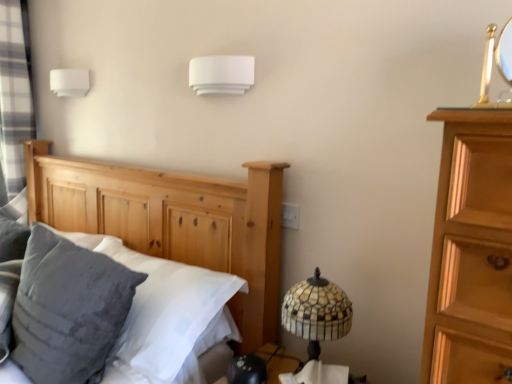
Question: Considering the relative sizes of gray plaid curtain at left and white matte rectangular object at upper left, arranged as the second lamp when viewed from the front, in the image provided, is gray plaid curtain at left thinner than white matte rectangular object at upper left, arranged as the second lamp when viewed from the front,?

Choices:
 (A) no
 (B) yes

Answer: (A)

Question: Considering the relative sizes of gray plaid curtain at left and white matte rectangular object at upper left, the 1th lamp when ordered from left to right, in the image provided, is gray plaid curtain at left taller than white matte rectangular object at upper left, the 1th lamp when ordered from left to right,?

Choices:
 (A) no
 (B) yes

Answer: (B)

Question: Are gray plaid curtain at left and white matte rectangular object at upper left, marked as the 2th lamp in a right-to-left arrangement, beside each other?

Choices:
 (A) no
 (B) yes

Answer: (A)

Question: Is gray plaid curtain at left facing towards white matte rectangular object at upper left, marked as the 2th lamp in a right-to-left arrangement?

Choices:
 (A) yes
 (B) no

Answer: (B)

Question: Considering the relative sizes of gray plaid curtain at left and white matte rectangular object at upper left, acting as the 1th lamp starting from the back, in the image provided, is gray plaid curtain at left bigger than white matte rectangular object at upper left, acting as the 1th lamp starting from the back,?

Choices:
 (A) no
 (B) yes

Answer: (B)

Question: In terms of width, does white plastic electric outlet at center look wider or thinner when compared to mosaic glass lampshade at lower right?

Choices:
 (A) thin
 (B) wide

Answer: (A)

Question: Based on their sizes in the image, would you say white plastic electric outlet at center is bigger or smaller than mosaic glass lampshade at lower right?

Choices:
 (A) big
 (B) small

Answer: (B)

Question: Is white plastic electric outlet at center to the left or to the right of mosaic glass lampshade at lower right in the image?

Choices:
 (A) left
 (B) right

Answer: (A)

Question: In terms of height, does white plastic electric outlet at center look taller or shorter compared to mosaic glass lampshade at lower right?

Choices:
 (A) short
 (B) tall

Answer: (A)

Question: Is velvety gray pillow at left situated inside natural wood bed at left or outside?

Choices:
 (A) outside
 (B) inside

Answer: (B)

Question: From their relative heights in the image, would you say velvety gray pillow at left is taller or shorter than natural wood bed at left?

Choices:
 (A) tall
 (B) short

Answer: (B)

Question: From the image's perspective, is velvety gray pillow at left positioned above or below natural wood bed at left?

Choices:
 (A) below
 (B) above

Answer: (B)

Question: Is velvety gray pillow at left wider or thinner than natural wood bed at left?

Choices:
 (A) wide
 (B) thin

Answer: (B)

Question: Considering their positions, is white plastic electric outlet at center located in front of or behind natural wood bed at left?

Choices:
 (A) behind
 (B) front

Answer: (A)

Question: Is point (284, 210) closer or farther from the camera than point (174, 180)?

Choices:
 (A) farther
 (B) closer

Answer: (B)